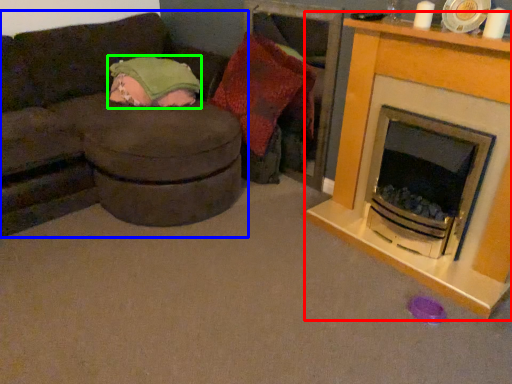
Question: Which object is the farthest from fireplace (highlighted by a red box)? Choose among these: studio couch (highlighted by a blue box) or blanket (highlighted by a green box).

Choices:
 (A) studio couch
 (B) blanket

Answer: (B)